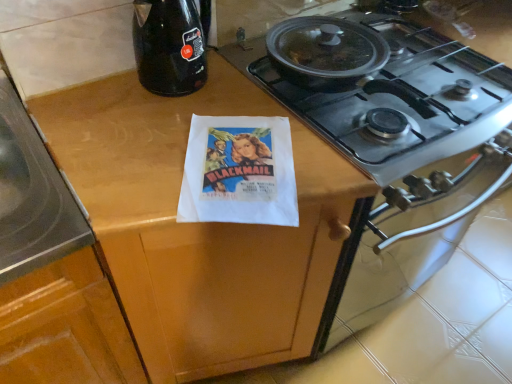
This screenshot has height=384, width=512. What are the coordinates of `free space in front of black glass bottle at upper left` in the screenshot? It's located at (172, 126).